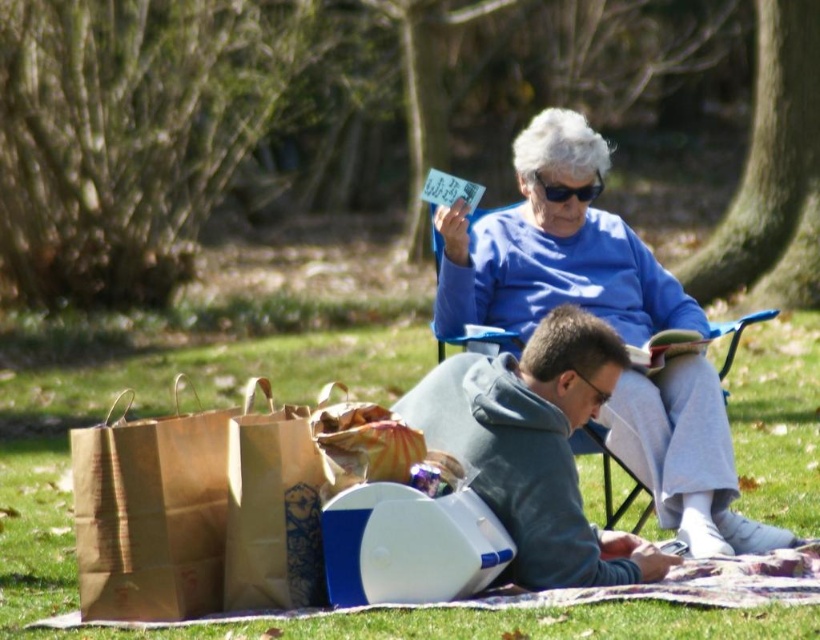
You are planning to take a nap on the picnic blanket. You see the gray fleece hoodie at lower center and the blue fabric chair at upper center. Which item is closer to the ground?

The blue fabric chair at upper center is closer to the ground because the gray fleece hoodie at lower center is located above it.

You are standing in the park and see both the blue cotton sweater at upper center and the blue fabric chair at upper center. Which object is positioned to the right side?

The blue cotton sweater at upper center is to the right of the blue fabric chair at upper center.

You are planning to take a nap on the picnic blanket. You have two options to use as a pillow between the gray fleece hoodie at lower center and the blue fabric chair at upper center. Which item would be more comfortable for your head to rest on?

The gray fleece hoodie at lower center would be more comfortable for resting your head since it has a greater height compared to the blue fabric chair at upper center, providing better support.